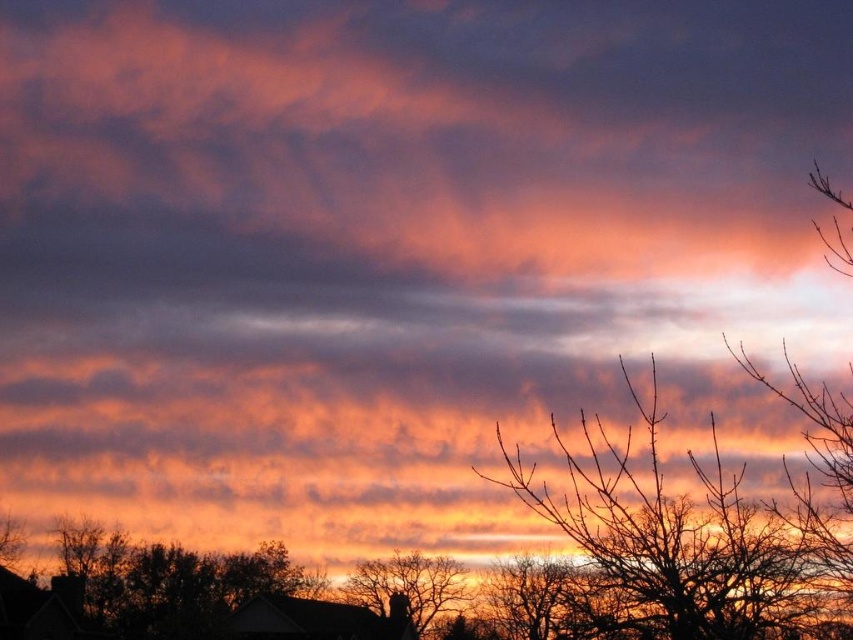
Question: Does smooth bark tree at center appear on the left side of silhouette bare tree at lower center?

Choices:
 (A) no
 (B) yes

Answer: (A)

Question: Which point is closer to the camera?

Choices:
 (A) (398, 556)
 (B) (630, 442)

Answer: (A)

Question: Which of the following is the closest to the observer?

Choices:
 (A) (584, 512)
 (B) (413, 580)

Answer: (A)

Question: Considering the relative positions of smooth bark tree at center and silhouette bare tree at lower center in the image provided, where is smooth bark tree at center located with respect to silhouette bare tree at lower center?

Choices:
 (A) right
 (B) left

Answer: (A)

Question: Is smooth bark tree at center above silhouette bare tree at lower center?

Choices:
 (A) yes
 (B) no

Answer: (A)

Question: Which object is farther from the camera taking this photo?

Choices:
 (A) smooth bark tree at center
 (B) silhouette bare tree at lower center

Answer: (B)